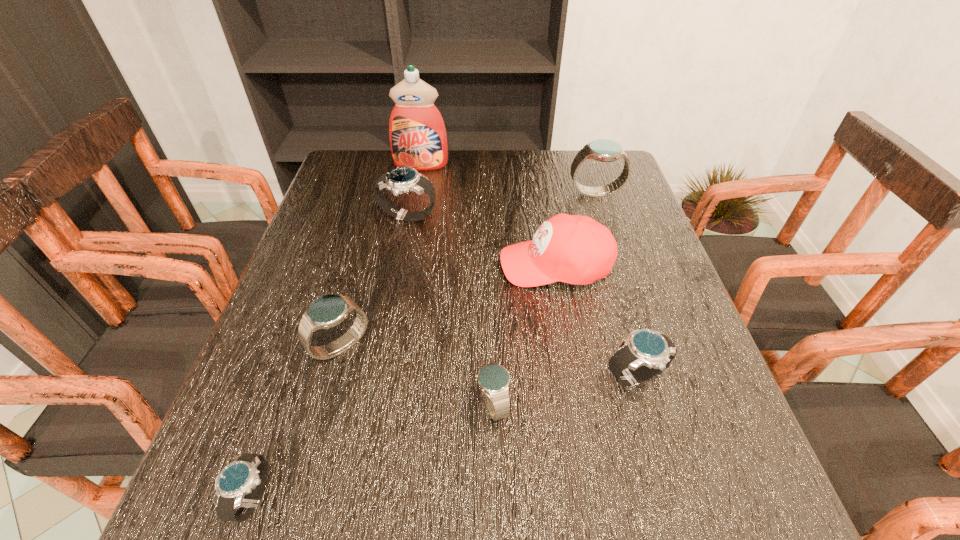
Identify the location of the farthest object. Image resolution: width=960 pixels, height=540 pixels. (418, 139).

This screenshot has width=960, height=540. In order to click on the tallest object in this screenshot , I will do `click(418, 139)`.

Where is `the rightmost blue watch`? This screenshot has height=540, width=960. the rightmost blue watch is located at coordinates (603, 150).

This screenshot has width=960, height=540. I want to click on the farthest blue watch, so click(x=603, y=150).

Identify the location of the biggest silver watch. This screenshot has width=960, height=540. (403, 179).

Find the location of `the third farthest object`. the third farthest object is located at coordinates (403, 179).

Identify the location of the fifth nearest object. The height and width of the screenshot is (540, 960). (575, 249).

At what (x,y) coordinates should I click in order to perform the action: click on the second biggest blue watch. Please return your answer as a coordinate pair (x, y). Image resolution: width=960 pixels, height=540 pixels. Looking at the image, I should click on (327, 311).

I want to click on the leftmost blue watch, so click(327, 311).

The height and width of the screenshot is (540, 960). I want to click on the second biggest silver watch, so click(646, 353).